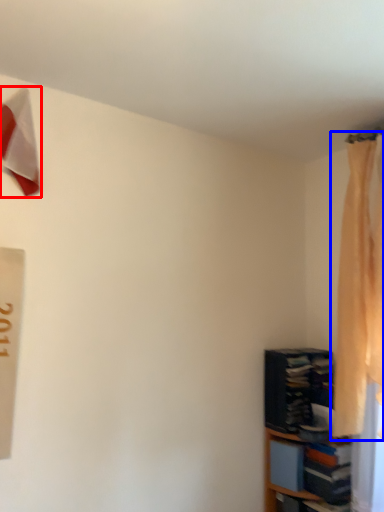
Question: Which of the following is the closest to the observer, twin (highlighted by a red box) or curtain (highlighted by a blue box)?

Choices:
 (A) twin
 (B) curtain

Answer: (A)